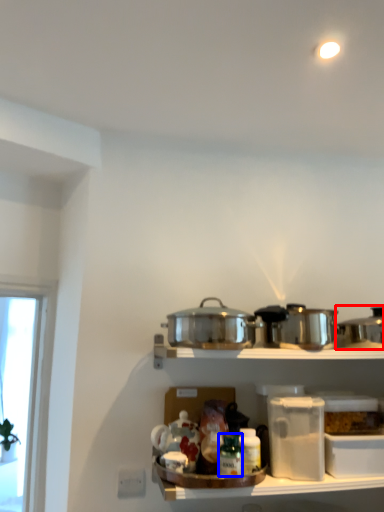
Question: Which point is closer to the camera, crock pot (highlighted by a red box) or bottle (highlighted by a blue box)?

Choices:
 (A) crock pot
 (B) bottle

Answer: (B)